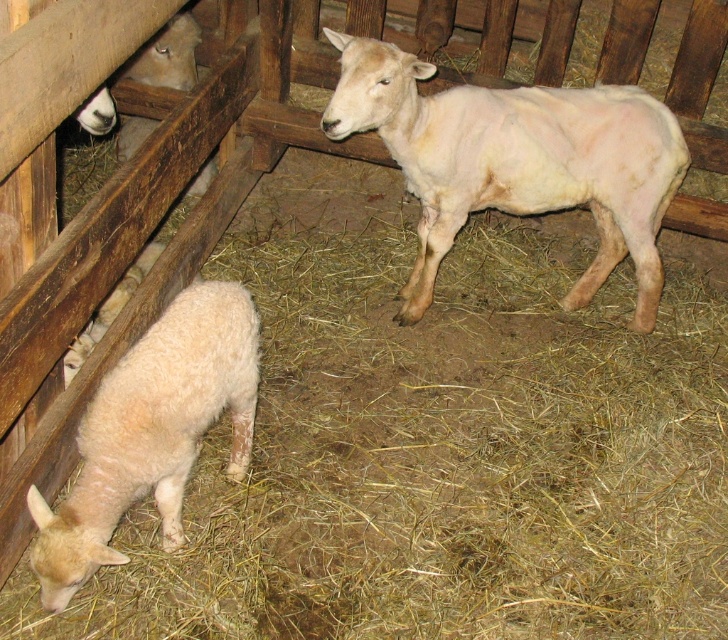
Does white woolen sheep at center have a larger size compared to white woolen lamb at lower left?

Yes.

How far apart are white woolen sheep at center and white woolen lamb at lower left?

A distance of 38.20 inches exists between white woolen sheep at center and white woolen lamb at lower left.

Does point (598, 234) lie behind point (36, 552)?

Yes, point (598, 234) is farther from viewer.

Where is `white woolen sheep at center`? The height and width of the screenshot is (640, 728). white woolen sheep at center is located at coordinates (515, 161).